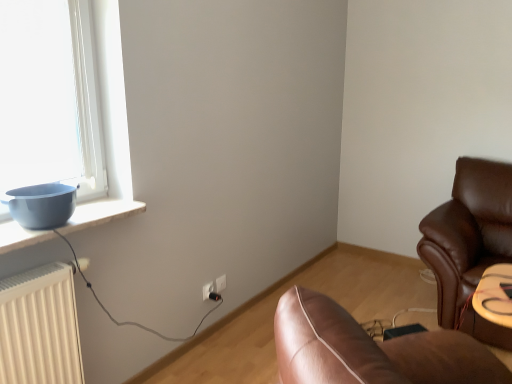
Question: Is black plastic plug at lower center far from white plastic electric outlet at lower center, placed as the first electric outlet when sorted from back to front?

Choices:
 (A) no
 (B) yes

Answer: (A)

Question: Considering the relative positions of black plastic plug at lower center and white plastic electric outlet at lower center, the first electric outlet from the right, in the image provided, is black plastic plug at lower center behind white plastic electric outlet at lower center, the first electric outlet from the right,?

Choices:
 (A) no
 (B) yes

Answer: (A)

Question: Is black plastic plug at lower center taller than white plastic electric outlet at lower center, the first electric outlet from the right?

Choices:
 (A) no
 (B) yes

Answer: (A)

Question: Considering the relative sizes of black plastic plug at lower center and white plastic electric outlet at lower center, placed as the first electric outlet when sorted from back to front, in the image provided, is black plastic plug at lower center bigger than white plastic electric outlet at lower center, placed as the first electric outlet when sorted from back to front,?

Choices:
 (A) yes
 (B) no

Answer: (A)

Question: Considering the relative sizes of black plastic plug at lower center and white plastic electric outlet at lower center, placed as the first electric outlet when sorted from back to front, in the image provided, is black plastic plug at lower center wider than white plastic electric outlet at lower center, placed as the first electric outlet when sorted from back to front,?

Choices:
 (A) no
 (B) yes

Answer: (B)

Question: From the image's perspective, is black plastic plug at lower center under white plastic electric outlet at lower center, which is the second electric outlet from left to right?

Choices:
 (A) no
 (B) yes

Answer: (B)

Question: Is white plastic electric outlet at center, the 2th electric outlet when ordered from right to left, facing towards white plastic electric outlet at lower center, placed as the first electric outlet when sorted from back to front?

Choices:
 (A) no
 (B) yes

Answer: (A)

Question: Does white plastic electric outlet at center, which is the first electric outlet in front-to-back order, come behind white plastic electric outlet at lower center, placed as the first electric outlet when sorted from back to front?

Choices:
 (A) yes
 (B) no

Answer: (B)

Question: Can you confirm if white plastic electric outlet at center, the 2th electric outlet when ordered from right to left, is positioned to the right of white plastic electric outlet at lower center, the first electric outlet from the right?

Choices:
 (A) yes
 (B) no

Answer: (B)

Question: From a real-world perspective, is white plastic electric outlet at center, which is the first electric outlet in front-to-back order, physically above white plastic electric outlet at lower center, the first electric outlet from the right?

Choices:
 (A) no
 (B) yes

Answer: (A)

Question: Does white plastic electric outlet at center, marked as the second electric outlet in a back-to-front arrangement, have a larger size compared to white plastic electric outlet at lower center, which is the second electric outlet in front-to-back order?

Choices:
 (A) yes
 (B) no

Answer: (A)

Question: From a real-world perspective, is white plastic electric outlet at center, which is the first electric outlet in front-to-back order, located beneath white plastic electric outlet at lower center, placed as the first electric outlet when sorted from back to front?

Choices:
 (A) no
 (B) yes

Answer: (B)

Question: Considering the relative sizes of white plastic electric outlet at lower center, the first electric outlet from the right, and white plastic electric outlet at center, the first electric outlet in the left-to-right sequence, in the image provided, is white plastic electric outlet at lower center, the first electric outlet from the right, taller than white plastic electric outlet at center, the first electric outlet in the left-to-right sequence,?

Choices:
 (A) no
 (B) yes

Answer: (A)